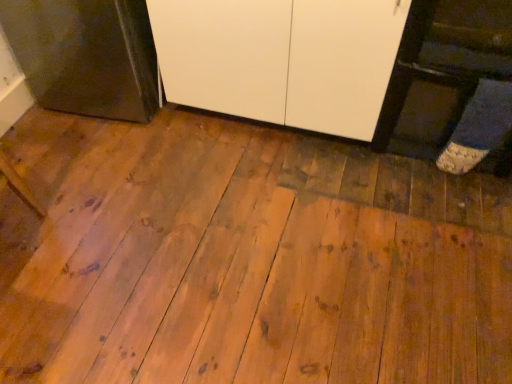
Question: Considering the relative sizes of metallic dark gray oven at left and white matte cabinet at center in the image provided, is metallic dark gray oven at left bigger than white matte cabinet at center?

Choices:
 (A) yes
 (B) no

Answer: (B)

Question: Is white matte cabinet at center at the back of metallic dark gray oven at left?

Choices:
 (A) yes
 (B) no

Answer: (B)

Question: Is metallic dark gray oven at left in front of white matte cabinet at center?

Choices:
 (A) yes
 (B) no

Answer: (B)

Question: Considering the relative sizes of metallic dark gray oven at left and white matte cabinet at center in the image provided, is metallic dark gray oven at left taller than white matte cabinet at center?

Choices:
 (A) yes
 (B) no

Answer: (B)

Question: Are metallic dark gray oven at left and white matte cabinet at center located far from each other?

Choices:
 (A) no
 (B) yes

Answer: (A)

Question: Is metallic dark gray oven at left at the left side of white matte cabinet at center?

Choices:
 (A) yes
 (B) no

Answer: (A)

Question: Can you confirm if white matte cabinet at center is thinner than metallic dark gray oven at left?

Choices:
 (A) no
 (B) yes

Answer: (A)

Question: Is white matte cabinet at center outside of metallic dark gray oven at left?

Choices:
 (A) no
 (B) yes

Answer: (B)

Question: Is the position of white matte cabinet at center more distant than that of metallic dark gray oven at left?

Choices:
 (A) yes
 (B) no

Answer: (B)

Question: From the image's perspective, is white matte cabinet at center on metallic dark gray oven at left?

Choices:
 (A) no
 (B) yes

Answer: (A)

Question: From a real-world perspective, is white matte cabinet at center located higher than metallic dark gray oven at left?

Choices:
 (A) yes
 (B) no

Answer: (A)

Question: Can you confirm if white matte cabinet at center is positioned to the right of metallic dark gray oven at left?

Choices:
 (A) no
 (B) yes

Answer: (B)

Question: Is metallic dark gray oven at left in front of or behind white matte cabinet at center in the image?

Choices:
 (A) front
 (B) behind

Answer: (B)